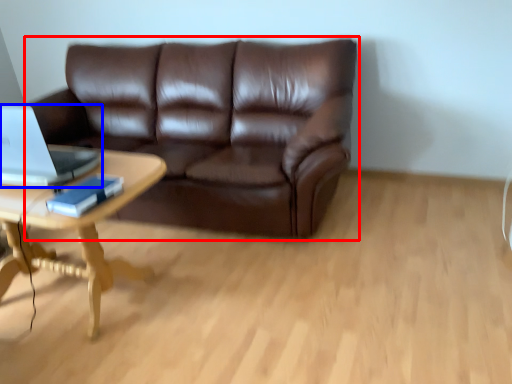
Question: Among these objects, which one is nearest to the camera, studio couch (highlighted by a red box) or laptop (highlighted by a blue box)?

Choices:
 (A) studio couch
 (B) laptop

Answer: (B)